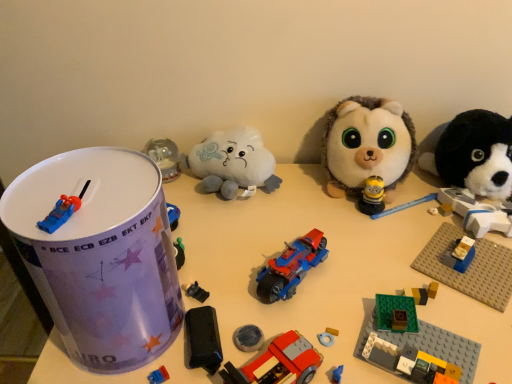
Question: Does green plastic building block at lower right, the third toy from the right, have a greater width compared to fluffy white plush at center, the 2th toy viewed from the right?

Choices:
 (A) no
 (B) yes

Answer: (A)

Question: Is the depth of green plastic building block at lower right, the third toy from the right, less than that of fluffy white plush at center, the 8th toy when ordered from left to right?

Choices:
 (A) no
 (B) yes

Answer: (B)

Question: Is green plastic building block at lower right, which is the 7th toy from left to right, touching fluffy white plush at center, the 8th toy when ordered from left to right?

Choices:
 (A) no
 (B) yes

Answer: (A)

Question: Is green plastic building block at lower right, which is the 7th toy from left to right, to the left of fluffy white plush at center, the 2th toy viewed from the right, from the viewer's perspective?

Choices:
 (A) yes
 (B) no

Answer: (A)

Question: Can you confirm if green plastic building block at lower right, the third toy from the right, is taller than fluffy white plush at center, the 2th toy viewed from the right?

Choices:
 (A) no
 (B) yes

Answer: (A)

Question: Is green plastic building block at lower right, the third toy from the right, further to camera compared to fluffy white plush at center, the 8th toy when ordered from left to right?

Choices:
 (A) yes
 (B) no

Answer: (B)

Question: Does black plastic toy car at center, which is the 6th toy in right-to-left order, come in front of green plastic building block at lower right, which is the 7th toy from left to right?

Choices:
 (A) yes
 (B) no

Answer: (B)

Question: Does black plastic toy car at center, which is the 6th toy in right-to-left order, have a greater height compared to green plastic building block at lower right, the third toy from the right?

Choices:
 (A) yes
 (B) no

Answer: (B)

Question: Does black plastic toy car at center, placed as the fourth toy when sorted from left to right, have a larger size compared to green plastic building block at lower right, the third toy from the right?

Choices:
 (A) yes
 (B) no

Answer: (B)

Question: Is green plastic building block at lower right, which is the 7th toy from left to right, at the back of black plastic toy car at center, which is the 6th toy in right-to-left order?

Choices:
 (A) yes
 (B) no

Answer: (B)

Question: From a real-world perspective, is black plastic toy car at center, placed as the fourth toy when sorted from left to right, over green plastic building block at lower right, which is the 7th toy from left to right?

Choices:
 (A) yes
 (B) no

Answer: (B)

Question: Does black plastic toy car at center, placed as the fourth toy when sorted from left to right, have a smaller size compared to green plastic building block at lower right, the third toy from the right?

Choices:
 (A) no
 (B) yes

Answer: (B)

Question: Does brick-patterned plastic car at center, acting as the 5th toy starting from the left, appear on the right side of blue plastic car at top left, positioned as the 9th toy in right-to-left order?

Choices:
 (A) no
 (B) yes

Answer: (B)